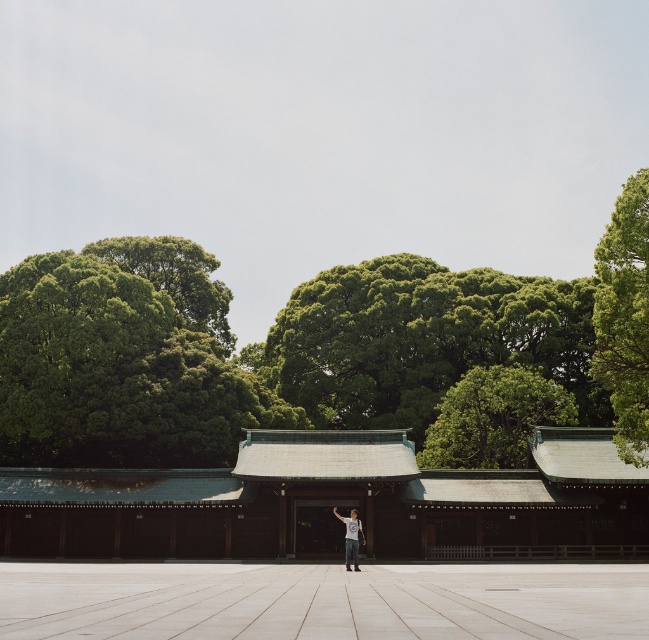
Question: Is green copper roof at center positioned at the back of green leafy tree at upper right?

Choices:
 (A) no
 (B) yes

Answer: (B)

Question: Is green copper roof at center positioned before green leafy tree at center?

Choices:
 (A) no
 (B) yes

Answer: (B)

Question: Which object appears farthest from the camera in this image?

Choices:
 (A) white cotton shirt at center
 (B) green copper roof at center
 (C) green leafy tree at center

Answer: (C)

Question: Does green leafy tree at center have a smaller size compared to white cotton shirt at center?

Choices:
 (A) no
 (B) yes

Answer: (A)

Question: Among these objects, which one is nearest to the camera?

Choices:
 (A) white cotton shirt at center
 (B) green leafy tree at upper right
 (C) green copper roof at center

Answer: (B)

Question: Among these points, which one is farthest from the camera?

Choices:
 (A) coord(472,429)
 (B) coord(354,515)
 (C) coord(177,474)
 (D) coord(628,339)

Answer: (A)